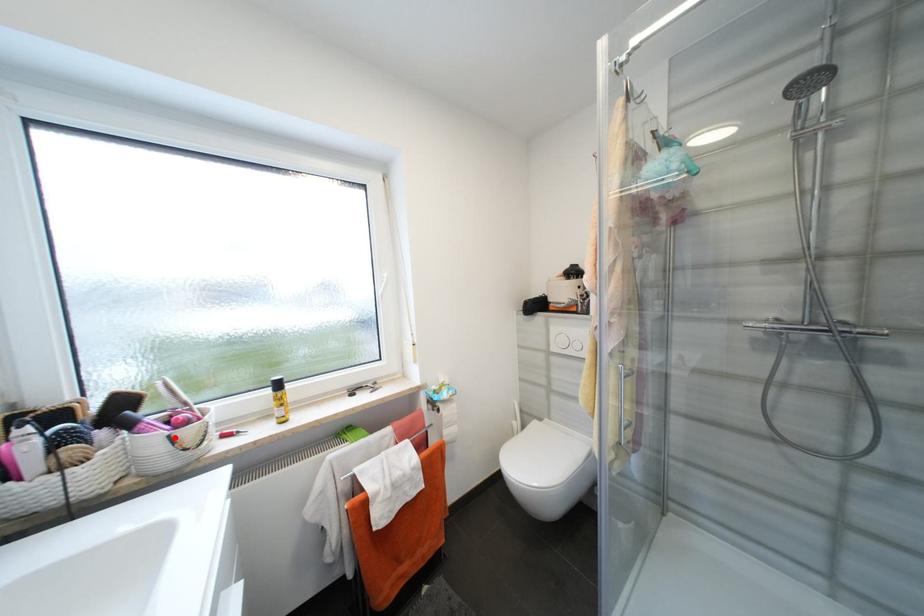
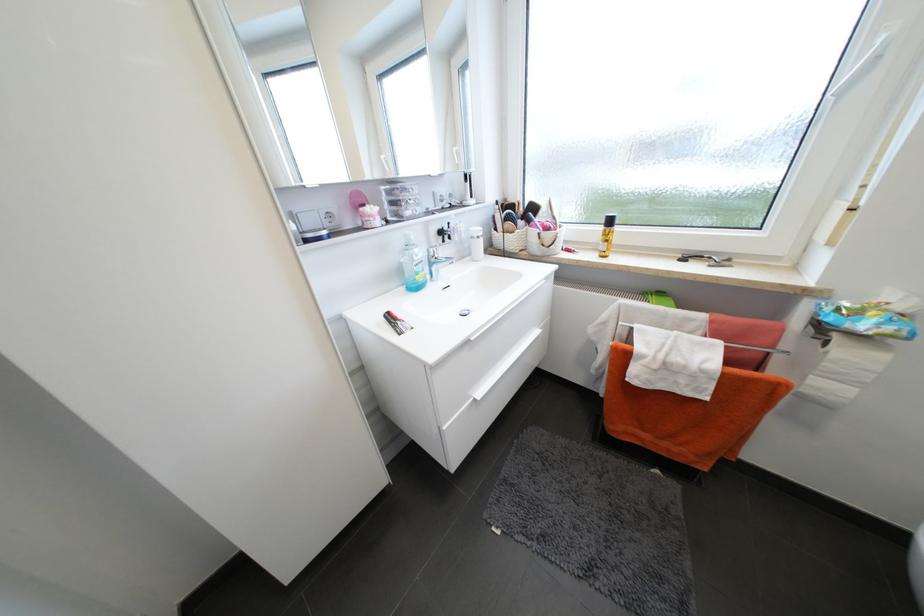
Find the pixel in the second image that matches the highlighted location in the first image.

(544, 235)